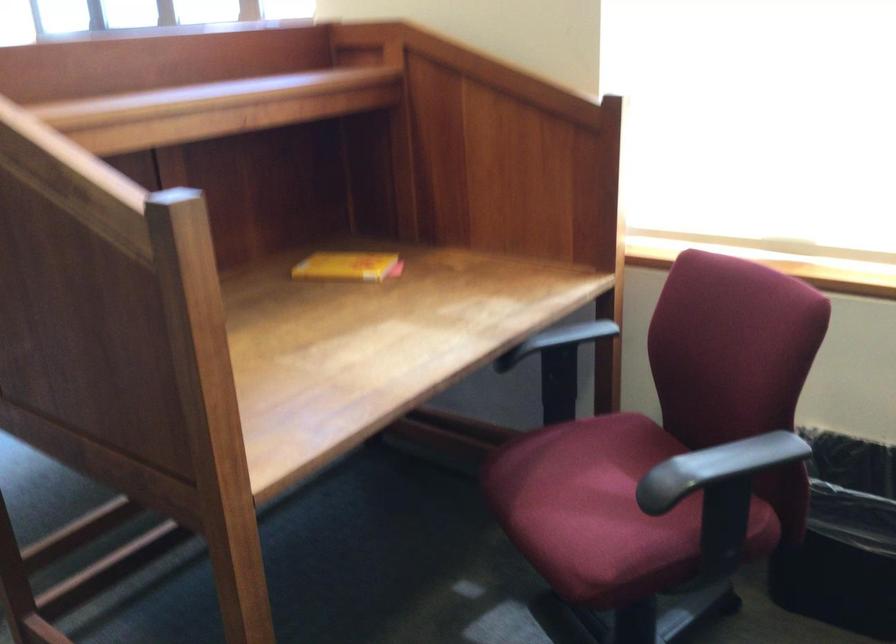
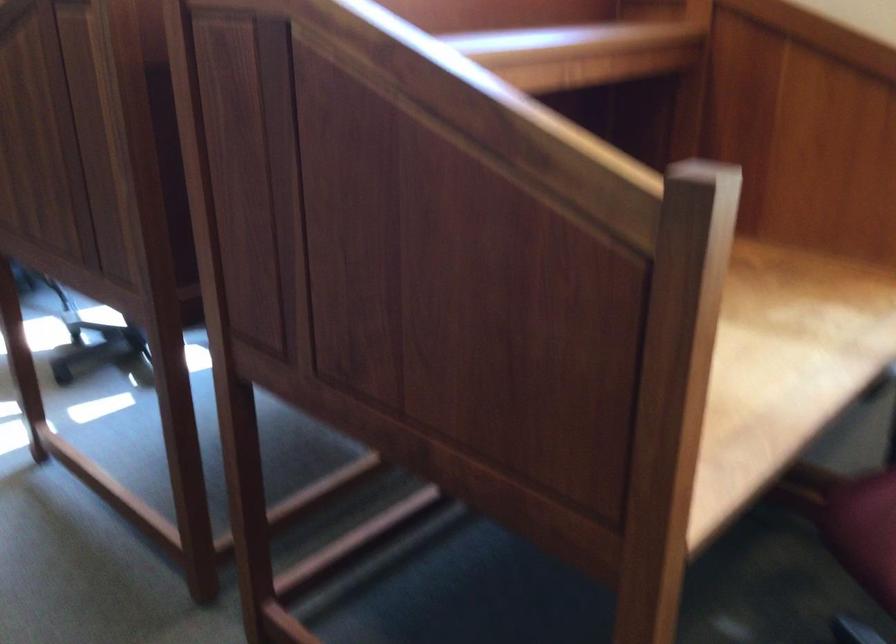
Find the pixel in the second image that matches point 421,348 in the first image.

(778, 360)